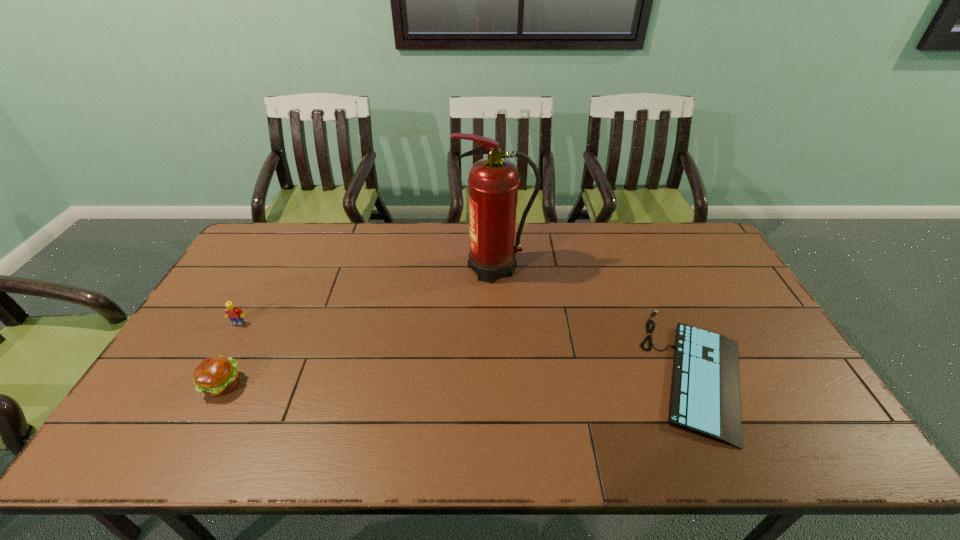
The width and height of the screenshot is (960, 540). I want to click on free area in between the third object from left to right and the shortest object, so 597,319.

Where is `empty location between the hamburger and the shortest object`? empty location between the hamburger and the shortest object is located at coordinates (461, 377).

This screenshot has height=540, width=960. In order to click on object that is the third closest one to the Lego in this screenshot , I will do `click(705, 392)`.

Locate which object ranks second in proximity to the rightmost object. Please provide its 2D coordinates. Your answer should be formatted as a tuple, i.e. [(x, y)], where the tuple contains the x and y coordinates of a point satisfying the conditions above.

[(215, 376)]

The width and height of the screenshot is (960, 540). Find the location of `free spot that satisfies the following two spatial constraints: 1. on the front-facing side of the tallest object; 2. on the front-facing side of the Lego`. free spot that satisfies the following two spatial constraints: 1. on the front-facing side of the tallest object; 2. on the front-facing side of the Lego is located at coordinates (497, 323).

In order to click on free space in the image that satisfies the following two spatial constraints: 1. on the front-facing side of the Lego; 2. on the left side of the hamburger in this screenshot , I will do `click(204, 384)`.

Find the location of `free space that satisfies the following two spatial constraints: 1. on the front-facing side of the hamburger; 2. on the right side of the Lego`. free space that satisfies the following two spatial constraints: 1. on the front-facing side of the hamburger; 2. on the right side of the Lego is located at coordinates (204, 384).

Locate an element on the screen. This screenshot has width=960, height=540. free region that satisfies the following two spatial constraints: 1. on the front-facing side of the fire extinguisher; 2. on the front side of the hamburger is located at coordinates (499, 384).

Find the location of a particular element. The width and height of the screenshot is (960, 540). blank space that satisfies the following two spatial constraints: 1. on the front-facing side of the fire extinguisher; 2. on the right side of the rightmost object is located at coordinates (498, 370).

I want to click on vacant space that satisfies the following two spatial constraints: 1. on the back side of the computer keyboard; 2. on the front-facing side of the tallest object, so click(653, 268).